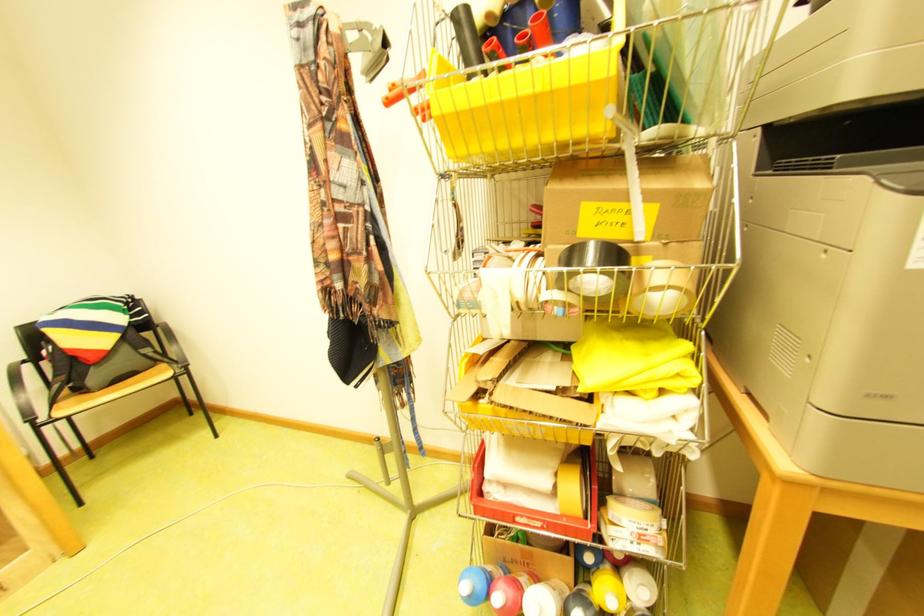
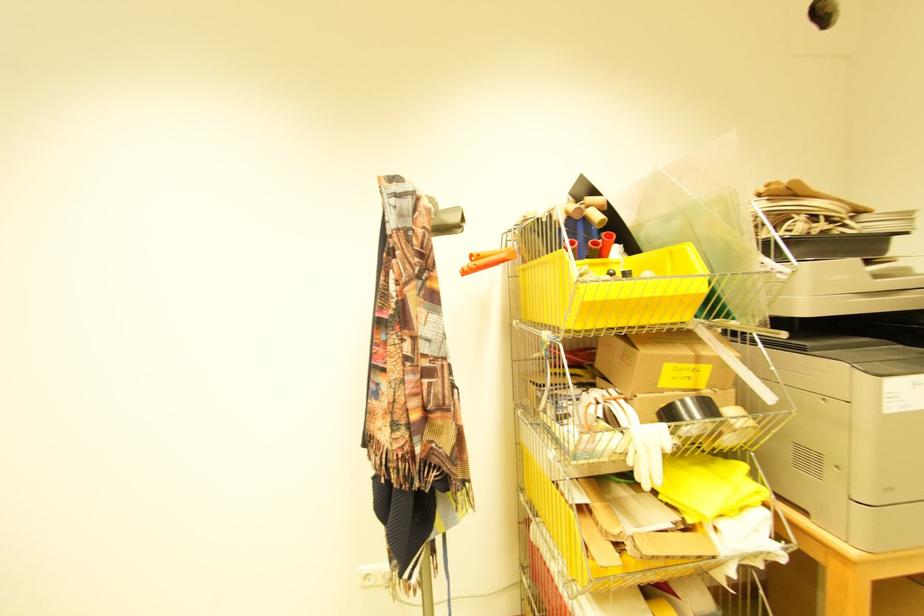
In the second image, find the point that corresponds to the point at 587,233 in the first image.

(669, 386)